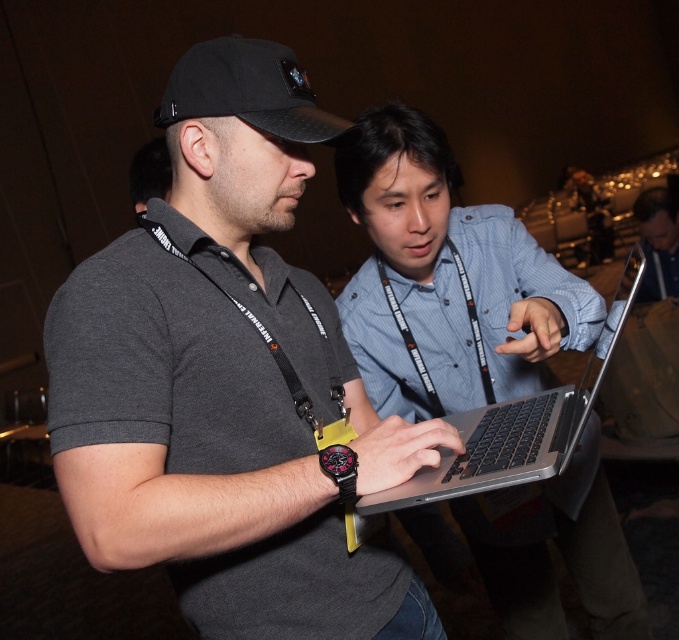
Between black fabric baseball cap at upper center and black fabric lanyard at center, which one appears on the left side from the viewer's perspective?

black fabric baseball cap at upper center

Is black fabric baseball cap at upper center positioned before black fabric lanyard at center?

Yes, it is in front of black fabric lanyard at center.

Where is `black fabric baseball cap at upper center`? Image resolution: width=679 pixels, height=640 pixels. black fabric baseball cap at upper center is located at coordinates (251, 92).

Find the location of `black fabric baseball cap at upper center`. black fabric baseball cap at upper center is located at coordinates pyautogui.click(x=251, y=92).

Who is shorter, blue denim shirt at center or silver metallic laptop at center?

Standing shorter between the two is silver metallic laptop at center.

Does blue denim shirt at center have a smaller size compared to silver metallic laptop at center?

Actually, blue denim shirt at center might be larger than silver metallic laptop at center.

Does point (392, 410) come behind point (636, 273)?

No.

Image resolution: width=679 pixels, height=640 pixels. I want to click on blue denim shirt at center, so click(x=445, y=280).

Consider the image. Who is positioned more to the right, dark gray polo shirt at center or silver metallic laptop at center?

Positioned to the right is silver metallic laptop at center.

Who is positioned more to the left, dark gray polo shirt at center or silver metallic laptop at center?

dark gray polo shirt at center

The image size is (679, 640). What do you see at coordinates (227, 380) in the screenshot?
I see `dark gray polo shirt at center` at bounding box center [227, 380].

Find the location of `dark gray polo shirt at center`. dark gray polo shirt at center is located at coordinates (227, 380).